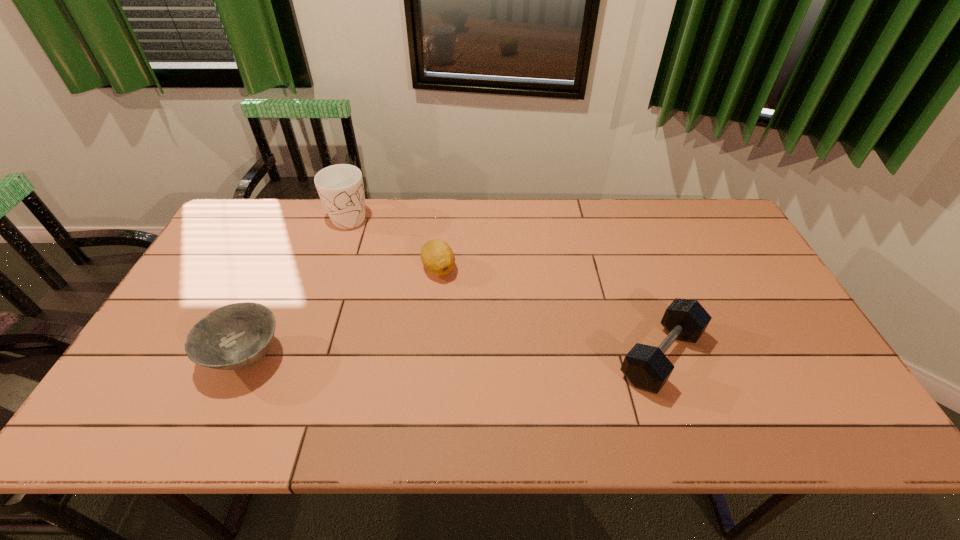
Locate an element on the screen. This screenshot has width=960, height=540. free spot between the bowl and the mug is located at coordinates (299, 286).

The width and height of the screenshot is (960, 540). What are the coordinates of `free space between the second farthest object and the dumbbell` in the screenshot? It's located at (550, 312).

Identify the location of free space between the farthest object and the rightmost object. The height and width of the screenshot is (540, 960). (506, 286).

Image resolution: width=960 pixels, height=540 pixels. What are the coordinates of `free space between the bowl and the third object from left to right` in the screenshot? It's located at (343, 313).

The height and width of the screenshot is (540, 960). In order to click on vacant space that is in between the tallest object and the second object from right to left in this screenshot , I will do `click(395, 242)`.

Find the location of `empty location between the farthest object and the bowl`. empty location between the farthest object and the bowl is located at coordinates (299, 286).

Select which object appears as the closest to the bowl. Please provide its 2D coordinates. Your answer should be formatted as a tuple, i.e. [(x, y)], where the tuple contains the x and y coordinates of a point satisfying the conditions above.

[(437, 256)]

Locate which object ranks third in proximity to the bowl. Please provide its 2D coordinates. Your answer should be formatted as a tuple, i.e. [(x, y)], where the tuple contains the x and y coordinates of a point satisfying the conditions above.

[(646, 367)]

Where is `free space in the image that satisfies the following two spatial constraints: 1. on the front side of the second object from right to left; 2. on the right side of the dumbbell`? The image size is (960, 540). free space in the image that satisfies the following two spatial constraints: 1. on the front side of the second object from right to left; 2. on the right side of the dumbbell is located at coordinates (430, 356).